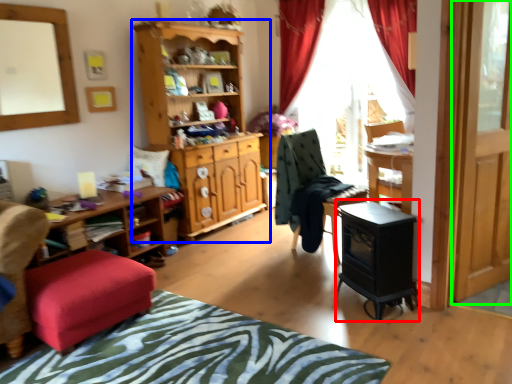
Question: Which is nearer to the computer desk (highlighted by a red box)? cabinetry (highlighted by a blue box) or screen door (highlighted by a green box).

Choices:
 (A) cabinetry
 (B) screen door

Answer: (B)